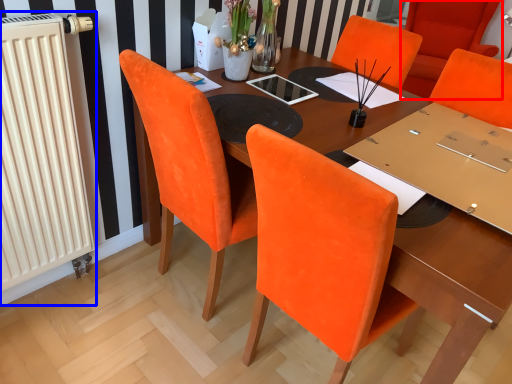
Question: Which point is closer to the camera, chair (highlighted by a red box) or radiator (highlighted by a blue box)?

Choices:
 (A) chair
 (B) radiator

Answer: (B)